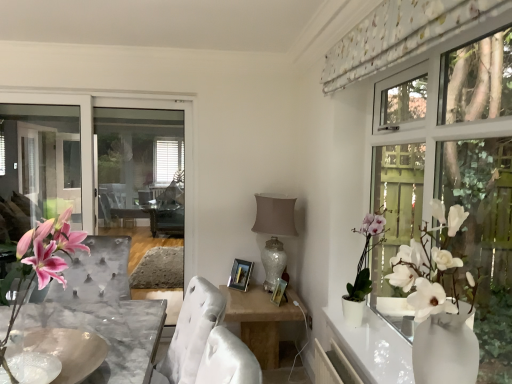
Question: Considering the relative positions of marble bowl at center and white floral fabric at upper right in the image provided, is marble bowl at center to the right of white floral fabric at upper right from the viewer's perspective?

Choices:
 (A) no
 (B) yes

Answer: (A)

Question: Considering the relative positions of marble bowl at center and white floral fabric at upper right in the image provided, is marble bowl at center behind white floral fabric at upper right?

Choices:
 (A) yes
 (B) no

Answer: (A)

Question: Does marble bowl at center touch white floral fabric at upper right?

Choices:
 (A) no
 (B) yes

Answer: (A)

Question: From the image's perspective, would you say marble bowl at center is positioned over white floral fabric at upper right?

Choices:
 (A) no
 (B) yes

Answer: (A)

Question: Is marble bowl at center taller than white floral fabric at upper right?

Choices:
 (A) no
 (B) yes

Answer: (A)

Question: From a real-world perspective, is marble bowl at center below white floral fabric at upper right?

Choices:
 (A) no
 (B) yes

Answer: (B)

Question: Does pink silk flowers at lower left turn towards white glossy lamp at center?

Choices:
 (A) no
 (B) yes

Answer: (A)

Question: Can you confirm if pink silk flowers at lower left is positioned to the right of white glossy lamp at center?

Choices:
 (A) yes
 (B) no

Answer: (B)

Question: Are pink silk flowers at lower left and white glossy lamp at center making contact?

Choices:
 (A) no
 (B) yes

Answer: (A)

Question: From the image's perspective, is pink silk flowers at lower left below white glossy lamp at center?

Choices:
 (A) yes
 (B) no

Answer: (B)

Question: From the image's perspective, is pink silk flowers at lower left located above white glossy lamp at center?

Choices:
 (A) no
 (B) yes

Answer: (B)

Question: From a real-world perspective, is pink silk flowers at lower left below white glossy lamp at center?

Choices:
 (A) no
 (B) yes

Answer: (A)

Question: Is white floral fabric at upper right thinner than white ceramic plant at upper right?

Choices:
 (A) yes
 (B) no

Answer: (A)